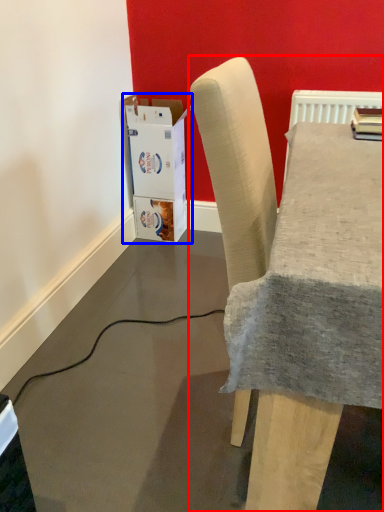
Question: Which object is closer to the camera taking this photo, chair (highlighted by a red box) or cardboard box (highlighted by a blue box)?

Choices:
 (A) chair
 (B) cardboard box

Answer: (A)